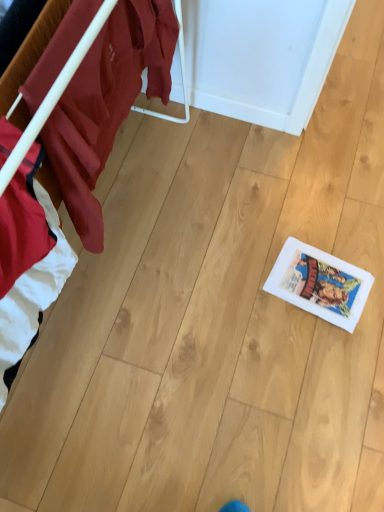
Question: Should I look upward or downward to see wooden floor at lower right?

Choices:
 (A) down
 (B) up

Answer: (B)

Question: Is wooden floor at lower right positioned far away from white paper comic book at lower right?

Choices:
 (A) yes
 (B) no

Answer: (B)

Question: Is wooden floor at lower right facing away from white paper comic book at lower right?

Choices:
 (A) yes
 (B) no

Answer: (B)

Question: From the image's perspective, is wooden floor at lower right located beneath white paper comic book at lower right?

Choices:
 (A) yes
 (B) no

Answer: (B)

Question: Could you tell me if wooden floor at lower right is turned towards white paper comic book at lower right?

Choices:
 (A) yes
 (B) no

Answer: (B)

Question: Does wooden floor at lower right appear on the right side of white paper comic book at lower right?

Choices:
 (A) yes
 (B) no

Answer: (B)

Question: From a real-world perspective, is wooden floor at lower right over white paper comic book at lower right?

Choices:
 (A) yes
 (B) no

Answer: (A)

Question: From a real-world perspective, is white paper comic book at lower right on wooden floor at lower right?

Choices:
 (A) yes
 (B) no

Answer: (B)

Question: Is white paper comic book at lower right behind wooden floor at lower right?

Choices:
 (A) yes
 (B) no

Answer: (A)

Question: Considering the relative sizes of white paper comic book at lower right and wooden floor at lower right in the image provided, is white paper comic book at lower right bigger than wooden floor at lower right?

Choices:
 (A) no
 (B) yes

Answer: (A)

Question: Is white paper comic book at lower right positioned before wooden floor at lower right?

Choices:
 (A) no
 (B) yes

Answer: (A)

Question: Is white paper comic book at lower right completely or partially outside of wooden floor at lower right?

Choices:
 (A) yes
 (B) no

Answer: (A)

Question: Is white paper comic book at lower right shorter than wooden floor at lower right?

Choices:
 (A) no
 (B) yes

Answer: (B)

Question: Considering the positions of wooden floor at lower right and white paper comic book at lower right in the image, is wooden floor at lower right wider or thinner than white paper comic book at lower right?

Choices:
 (A) thin
 (B) wide

Answer: (A)